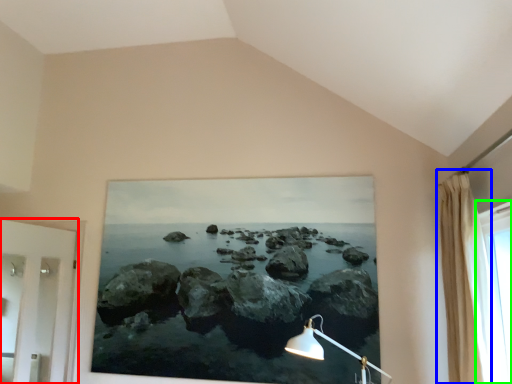
Question: Considering the real-world distances, which object is farthest from door (highlighted by a red box)? curtain (highlighted by a blue box) or window (highlighted by a green box)?

Choices:
 (A) curtain
 (B) window

Answer: (B)